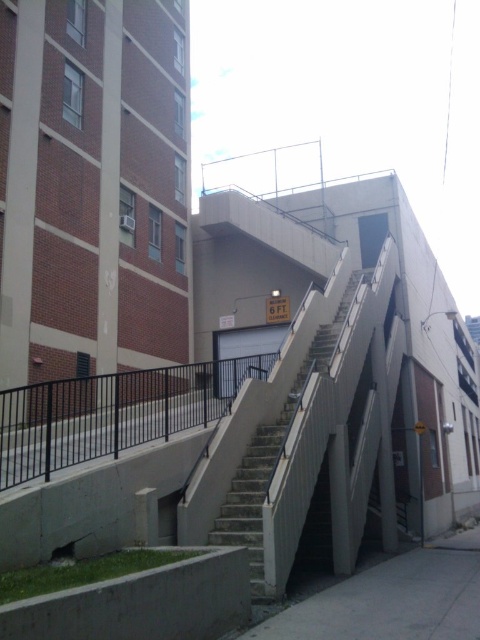
You are a delivery person holding a package that needs to be delivered to a location marked by the point at coordinates point (x=36, y=412) and point (x=255, y=589). As you approach the building, you notice that you must walk past both points. Which point should you reach first?

You should reach point (x=36, y=412) first because it is closer to you than point (x=255, y=589), which is further away.

You are a delivery person with a wide cart that is 2 meters wide. You need to move from the black metal railing at lower left to the gray concrete pavement at lower center. Can your cart fit through the space between them?

The black metal railing at lower left has a larger width than the gray concrete pavement at lower center. Since your cart is 2 meters wide, it can only fit through the space if the gray concrete pavement at lower center is wide enough. However, the description states that the black metal railing at lower left is wider, so the gray concrete pavement at lower center might be narrower than the railing. Therefore, there is a risk that the cart may not fit through the narrower gray concrete pavement at lower